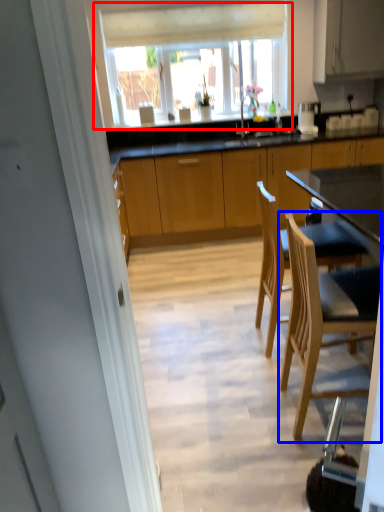
Question: Among these objects, which one is farthest to the camera, window (highlighted by a red box) or chair (highlighted by a blue box)?

Choices:
 (A) window
 (B) chair

Answer: (A)